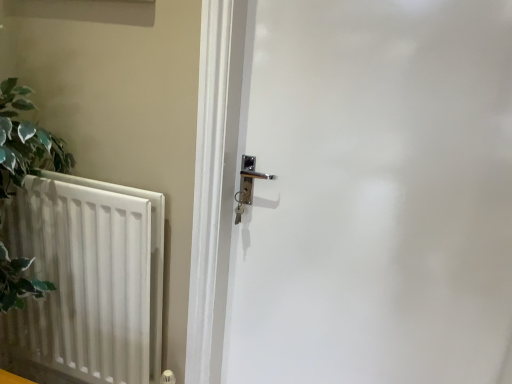
Question: From a real-world perspective, is white glossy door at center physically below white matte radiator at left?

Choices:
 (A) yes
 (B) no

Answer: (B)

Question: Are white glossy door at center and white matte radiator at left located far from each other?

Choices:
 (A) no
 (B) yes

Answer: (A)

Question: Does white glossy door at center turn towards white matte radiator at left?

Choices:
 (A) no
 (B) yes

Answer: (A)

Question: Is white glossy door at center further to the viewer compared to white matte radiator at left?

Choices:
 (A) yes
 (B) no

Answer: (B)

Question: From the image's perspective, is white glossy door at center located above white matte radiator at left?

Choices:
 (A) no
 (B) yes

Answer: (B)

Question: Is white glossy door at center not inside white matte radiator at left?

Choices:
 (A) no
 (B) yes

Answer: (B)

Question: From the image's perspective, is white matte radiator at left above white glossy door at center?

Choices:
 (A) yes
 (B) no

Answer: (B)

Question: Is white matte radiator at left turned away from white glossy door at center?

Choices:
 (A) no
 (B) yes

Answer: (A)

Question: Considering the relative positions of white matte radiator at left and white glossy door at center in the image provided, is white matte radiator at left to the right of white glossy door at center from the viewer's perspective?

Choices:
 (A) yes
 (B) no

Answer: (B)

Question: From a real-world perspective, is white matte radiator at left beneath white glossy door at center?

Choices:
 (A) yes
 (B) no

Answer: (A)

Question: Are white matte radiator at left and white glossy door at center located far from each other?

Choices:
 (A) yes
 (B) no

Answer: (B)

Question: Would you say white matte radiator at left is outside white glossy door at center?

Choices:
 (A) yes
 (B) no

Answer: (A)

Question: In terms of size, does white matte radiator at left appear bigger or smaller than white glossy door at center?

Choices:
 (A) big
 (B) small

Answer: (B)